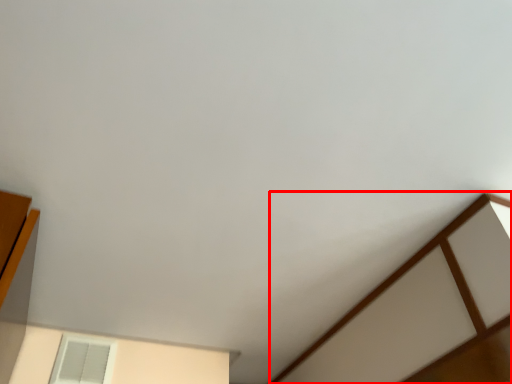
Question: Considering the relative positions of furniture (annotated by the red box) and window in the image provided, where is furniture (annotated by the red box) located with respect to the staircase?

Choices:
 (A) right
 (B) left

Answer: (A)